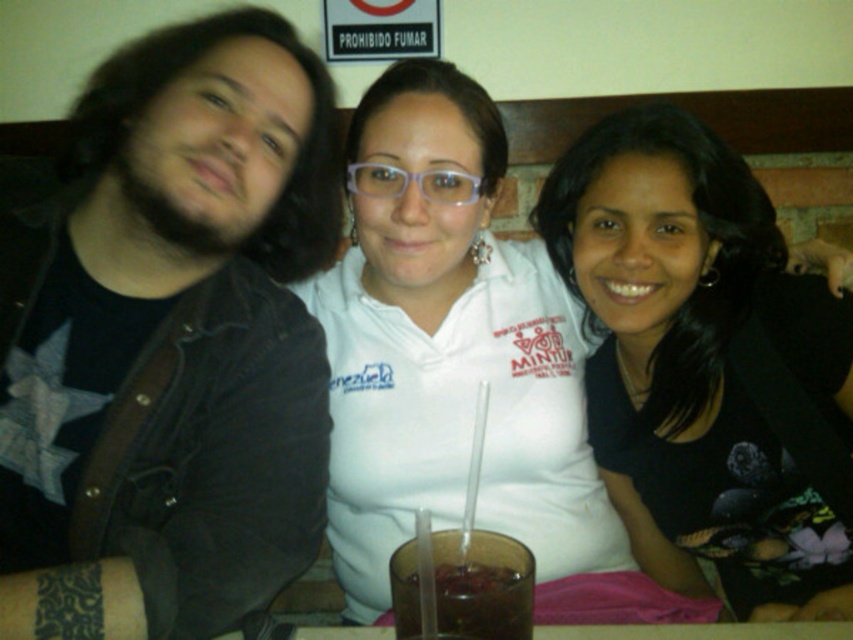
Which of these two, dark denim jacket at left or black matte shirt at center, stands shorter?

dark denim jacket at left

Does dark denim jacket at left appear under black matte shirt at center?

Actually, dark denim jacket at left is above black matte shirt at center.

Measure the distance between point (x=96, y=552) and camera.

Point (x=96, y=552) is 3.39 feet from camera.

Locate an element on the screen. dark denim jacket at left is located at coordinates (172, 333).

Who is taller, black matte shirt at center or brown translucent glass at center?

Standing taller between the two is black matte shirt at center.

Between black matte shirt at center and brown translucent glass at center, which one has less height?

brown translucent glass at center is shorter.

Find the location of a particular element. This screenshot has height=640, width=853. black matte shirt at center is located at coordinates (701, 362).

Can you confirm if dark denim jacket at left is positioned above brown translucent glass at center?

Yes, dark denim jacket at left is above brown translucent glass at center.

Is dark denim jacket at left positioned behind brown translucent glass at center?

Yes.

This screenshot has height=640, width=853. In order to click on dark denim jacket at left in this screenshot , I will do `click(172, 333)`.

Locate an element on the screen. dark denim jacket at left is located at coordinates (172, 333).